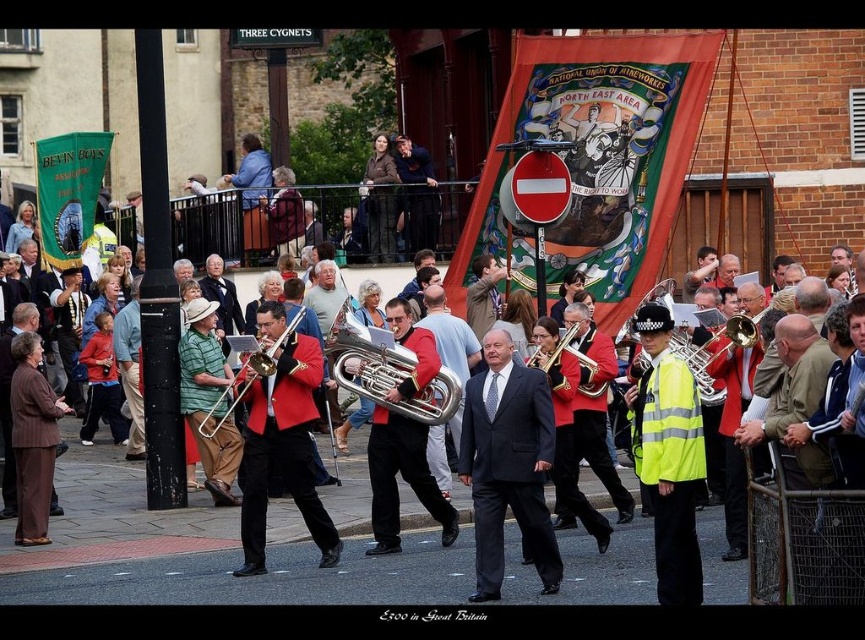
Question: Can you confirm if shiny red jacket at center is positioned below brass shiny trumpet at center?

Choices:
 (A) yes
 (B) no

Answer: (A)

Question: Can you confirm if brushed brass trombone at center is bigger than shiny brass trumpet at center?

Choices:
 (A) no
 (B) yes

Answer: (B)

Question: Which of the following is the closest to the observer?

Choices:
 (A) (311, 452)
 (B) (629, 323)
 (C) (475, 550)

Answer: (C)

Question: Is red velvet jacket at center bigger than shiny brass tuba at center?

Choices:
 (A) yes
 (B) no

Answer: (A)

Question: Which point is farther from the camera taking this photo?

Choices:
 (A) (274, 340)
 (B) (20, 516)
 (C) (479, 442)

Answer: (A)

Question: Based on their relative distances, which object is nearer to the red velvet tuba at center?

Choices:
 (A) brown textured suit at lower left
 (B) red velvet jacket at center
 (C) brass polished trombone at center
 (D) shiny brass trumpet at center

Answer: (B)